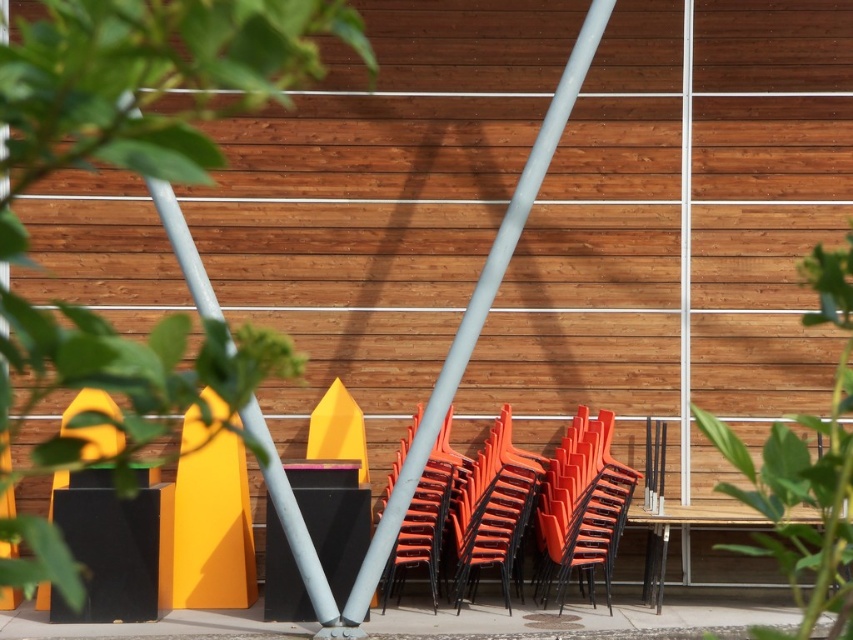
Is orange plastic chairs at center smaller than smooth gray pole at center?

Correct, orange plastic chairs at center occupies less space than smooth gray pole at center.

This screenshot has width=853, height=640. What are the coordinates of `orange plastic chairs at center` in the screenshot? It's located at click(543, 508).

The height and width of the screenshot is (640, 853). In order to click on orange plastic chairs at center in this screenshot , I will do `click(543, 508)`.